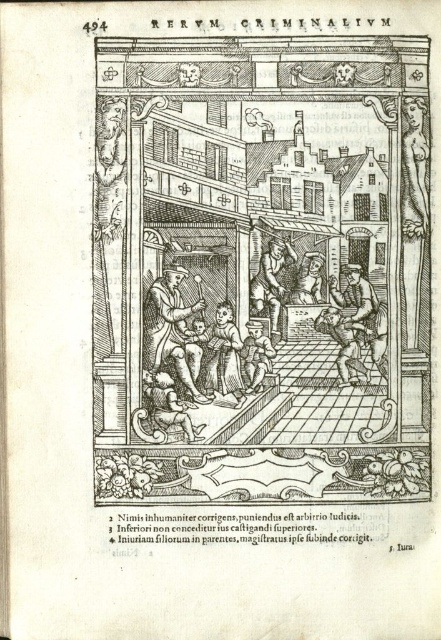
Measure the distance between point (194, 301) and camera.

Point (194, 301) and camera are 4.17 feet apart.

Does point (169, 337) come farther from viewer compared to point (284, 289)?

No, (169, 337) is in front of (284, 289).

You are a GUI agent. You are given a task and a screenshot of the screen. Output one action in this format:
    pyautogui.click(x=<x>, y=<y>)
    Task: Click on the wooden staff at center
    The image size is (441, 640).
    Given the screenshot: What is the action you would take?
    pyautogui.click(x=171, y=330)